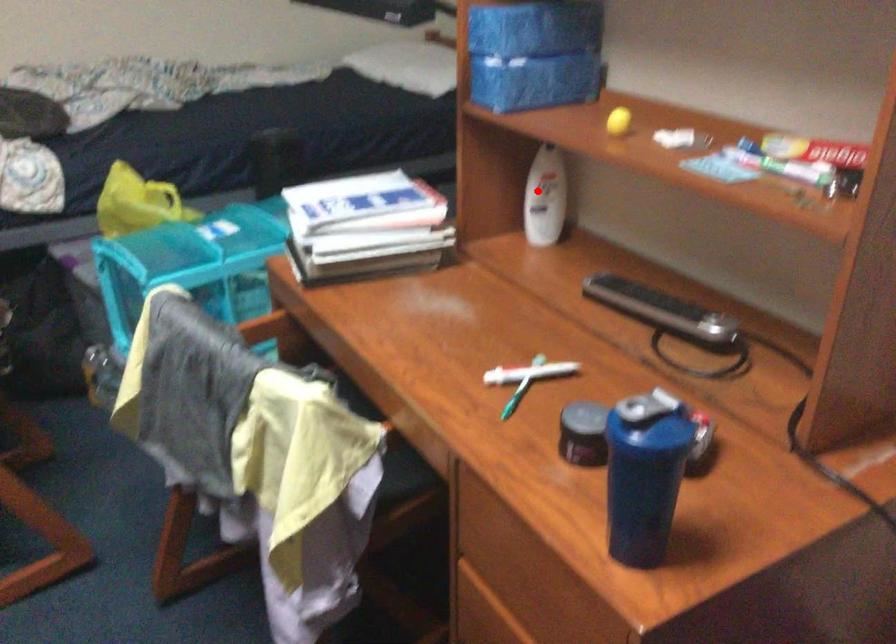
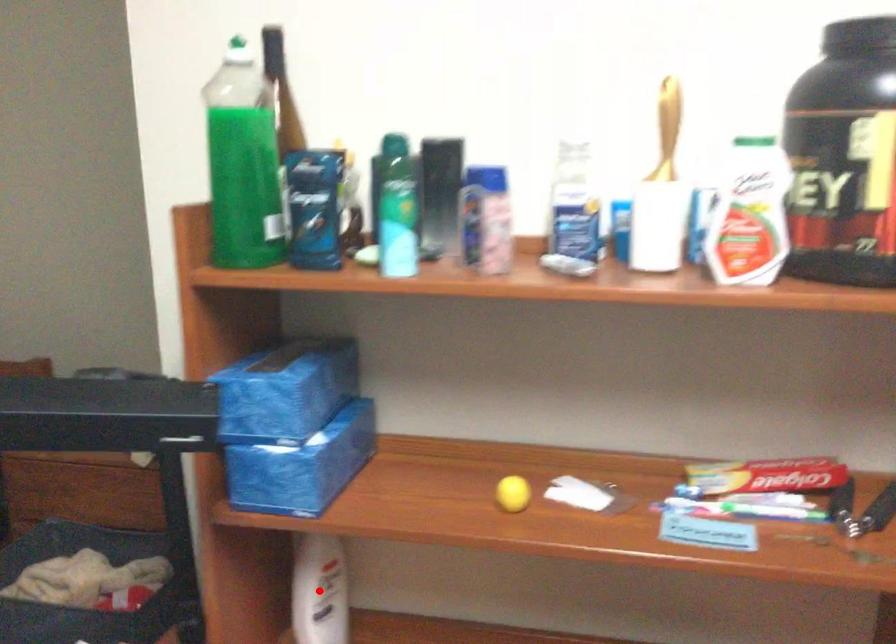
I am providing you with two images of the same scene from different viewpoints. A red point is marked on the first image and another point is marked on the second image. Does the point marked in image1 correspond to the same location as the one in image2?

Yes